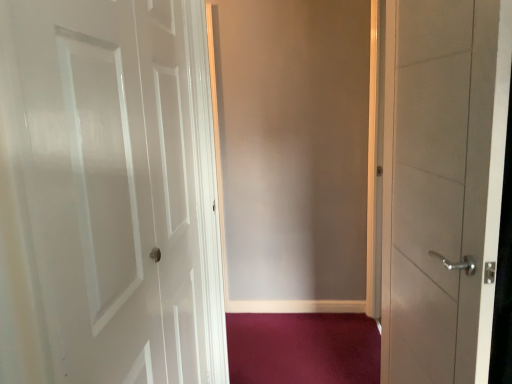
Question: Can you confirm if purple carpet at lower center is shorter than white glossy door at left, the second door from the right?

Choices:
 (A) no
 (B) yes

Answer: (B)

Question: Is white glossy door at left, the second door from the right, inside purple carpet at lower center?

Choices:
 (A) no
 (B) yes

Answer: (A)

Question: Is purple carpet at lower center looking in the opposite direction of white glossy door at left, the first door in the left-to-right sequence?

Choices:
 (A) yes
 (B) no

Answer: (B)

Question: Is purple carpet at lower center closer to camera compared to white glossy door at left, the second door from the right?

Choices:
 (A) yes
 (B) no

Answer: (B)

Question: Does purple carpet at lower center have a greater height compared to white glossy door at left, the first door in the left-to-right sequence?

Choices:
 (A) no
 (B) yes

Answer: (A)

Question: Can you confirm if purple carpet at lower center is smaller than white glossy door at left, the first door in the left-to-right sequence?

Choices:
 (A) no
 (B) yes

Answer: (B)

Question: From the image's perspective, is satin white door at right, marked as the first door in a right-to-left arrangement, over matte gray screen door at center?

Choices:
 (A) yes
 (B) no

Answer: (B)

Question: Is satin white door at right, arranged as the second door when viewed from the left, positioned before matte gray screen door at center?

Choices:
 (A) yes
 (B) no

Answer: (A)

Question: From a real-world perspective, is satin white door at right, marked as the first door in a right-to-left arrangement, on matte gray screen door at center?

Choices:
 (A) yes
 (B) no

Answer: (A)

Question: Can matte gray screen door at center be found inside satin white door at right, marked as the first door in a right-to-left arrangement?

Choices:
 (A) no
 (B) yes

Answer: (A)

Question: Is satin white door at right, marked as the first door in a right-to-left arrangement, further to camera compared to matte gray screen door at center?

Choices:
 (A) no
 (B) yes

Answer: (A)

Question: From the image's perspective, does satin white door at right, marked as the first door in a right-to-left arrangement, appear lower than matte gray screen door at center?

Choices:
 (A) no
 (B) yes

Answer: (B)

Question: Would you consider matte gray screen door at center to be distant from satin white door at right, arranged as the second door when viewed from the left?

Choices:
 (A) yes
 (B) no

Answer: (A)